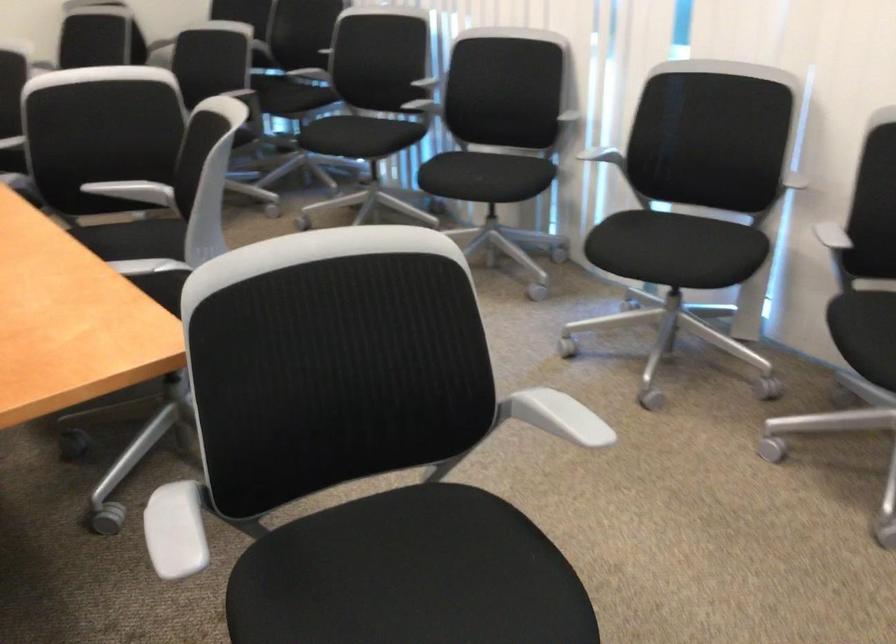
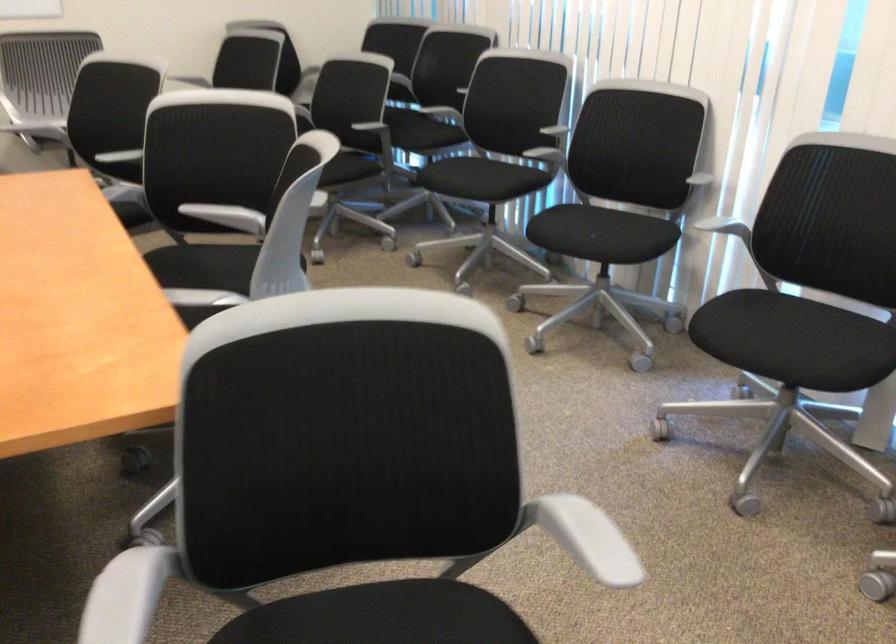
In the second image, find the point that corresponds to the point at 605,154 in the first image.

(725, 228)